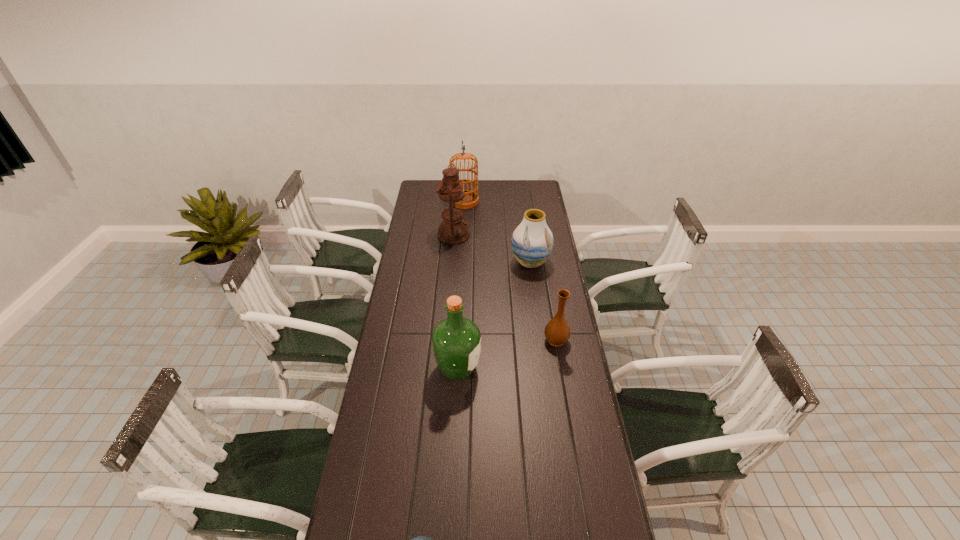
I want to click on object positioned at the far edge, so click(x=471, y=197).

Find the location of `blank space at the far edge of the desktop`. blank space at the far edge of the desktop is located at coordinates (508, 198).

The image size is (960, 540). I want to click on free region at the left edge of the desktop, so click(435, 206).

Where is `free space at the right edge of the desktop`? free space at the right edge of the desktop is located at coordinates (543, 264).

Image resolution: width=960 pixels, height=540 pixels. I want to click on vacant area at the far right corner of the desktop, so click(x=525, y=191).

You are a GUI agent. You are given a task and a screenshot of the screen. Output one action in this format:
    pyautogui.click(x=<x>, y=<y>)
    Task: Click on the vacant area between the second nearest vase and the third farthest object
    The height and width of the screenshot is (540, 960).
    Given the screenshot: What is the action you would take?
    coord(543,301)

Identify the location of vacant area that lies between the birdcage and the third farthest object. (497, 232).

Identify which object is the fifth nearest to the second nearest vase. Please provide its 2D coordinates. Your answer should be formatted as a tuple, i.e. [(x, y)], where the tuple contains the x and y coordinates of a point satisfying the conditions above.

[(471, 197)]

Locate which object ranks third in proximity to the fourth nearest object. Please provide its 2D coordinates. Your answer should be formatted as a tuple, i.e. [(x, y)], where the tuple contains the x and y coordinates of a point satisfying the conditions above.

[(471, 197)]

The image size is (960, 540). What are the coordinates of `vase identified as the third closest to the second farthest object` in the screenshot? It's located at (420, 539).